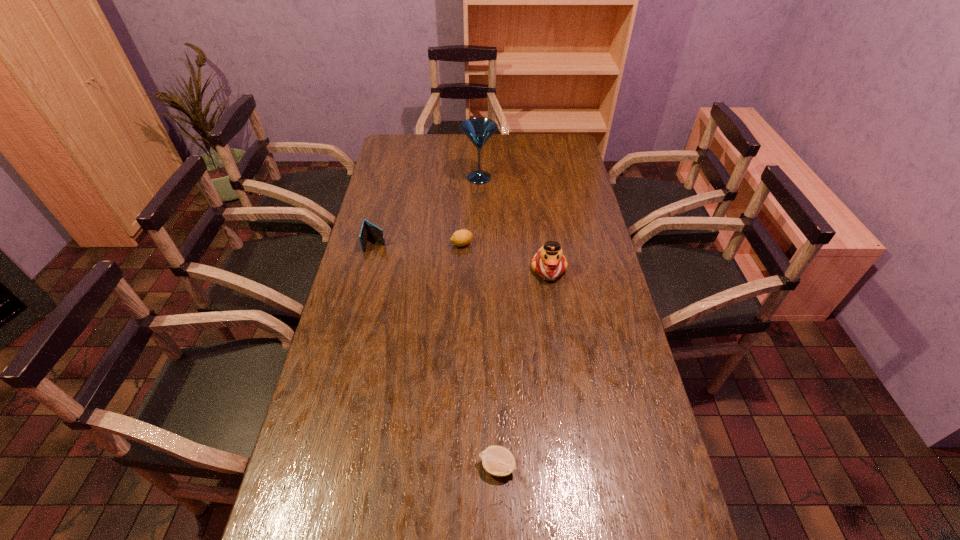
Where is `the farthest object`? The width and height of the screenshot is (960, 540). the farthest object is located at coordinates (479, 130).

Identify the location of martini. (479, 130).

Find the location of a particular element. The width and height of the screenshot is (960, 540). the fourth shortest object is located at coordinates (549, 263).

This screenshot has height=540, width=960. I want to click on the rightmost object, so click(x=549, y=263).

Where is `the third tallest object`? This screenshot has height=540, width=960. the third tallest object is located at coordinates (368, 229).

Where is `the leftmost object`? The image size is (960, 540). the leftmost object is located at coordinates (368, 229).

Image resolution: width=960 pixels, height=540 pixels. What are the coordinates of `the left lemon` in the screenshot? It's located at [x=462, y=237].

This screenshot has height=540, width=960. In order to click on the farther lemon in this screenshot , I will do `click(462, 237)`.

Locate an element on the screen. The image size is (960, 540). the nearer lemon is located at coordinates (498, 461).

At what (x,y) coordinates should I click in order to perform the action: click on the shorter lemon. Please return your answer as a coordinate pair (x, y). The image size is (960, 540). Looking at the image, I should click on (498, 461).